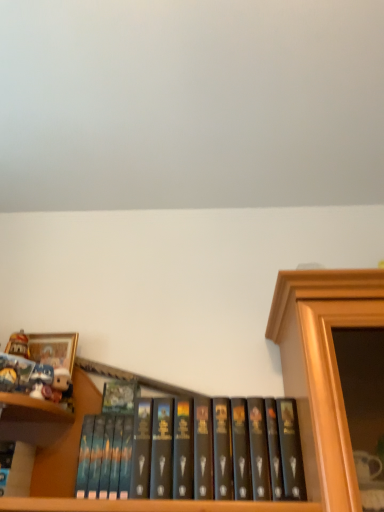
I want to click on gold-framed picture at upper left, so click(x=54, y=349).

Locate an element on the screen. black matte book at center, arranged as the 2th book when viewed from the left is located at coordinates coord(194,451).

Which object is wider, black matte book at center, which ranks as the first book in right-to-left order, or matte white plush toy at upper left?

black matte book at center, which ranks as the first book in right-to-left order.

In the image, is black matte book at center, which ranks as the first book in right-to-left order, positioned in front of or behind matte white plush toy at upper left?

In the image, black matte book at center, which ranks as the first book in right-to-left order, appears in front of matte white plush toy at upper left.

Can you confirm if black matte book at center, which ranks as the first book in right-to-left order, is bigger than matte white plush toy at upper left?

Yes.

In the scene shown: Is gold-framed picture at upper left inside black matte book at center, which ranks as the first book in right-to-left order?

No, black matte book at center, which ranks as the first book in right-to-left order, does not contain gold-framed picture at upper left.

I want to click on picture frame on the left of black matte book at center, which is the 2th book from top to bottom, so click(x=54, y=349).

Consider the image. Can you tell me how much black matte book at center, which is the 2th book from top to bottom, and gold-framed picture at upper left differ in facing direction?

The facing directions of black matte book at center, which is the 2th book from top to bottom, and gold-framed picture at upper left are 0.632 degrees apart.

Can you confirm if black matte book at center, which is the 2th book from top to bottom, is bigger than gold-framed picture at upper left?

Indeed, black matte book at center, which is the 2th book from top to bottom, has a larger size compared to gold-framed picture at upper left.

Is point (32, 351) less distant than point (8, 355)?

No, (32, 351) is behind (8, 355).

Who is taller, gold-framed picture at upper left or hardcover book at left, marked as the 1th book in a top-to-bottom arrangement?

gold-framed picture at upper left is taller.

Is hardcover book at left, marked as the 1th book in a top-to-bottom arrangement, at the back of gold-framed picture at upper left?

That's not correct — gold-framed picture at upper left is not looking away from hardcover book at left, marked as the 1th book in a top-to-bottom arrangement.

From the picture: From a real-world perspective, is gold-framed picture at upper left physically below hardcover book at left, marked as the 1th book in a top-to-bottom arrangement?

No, from a real-world perspective, gold-framed picture at upper left is not below hardcover book at left, marked as the 1th book in a top-to-bottom arrangement.

From a real-world perspective, is black matte book at center, which is the 2th book from top to bottom, physically below hardcover book at left, which is counted as the second book, starting from the right?

Yes, from a real-world perspective, black matte book at center, which is the 2th book from top to bottom, is under hardcover book at left, which is counted as the second book, starting from the right.

From the image's perspective, is black matte book at center, which is the 2th book from top to bottom, under hardcover book at left, which is counted as the second book, starting from the right?

Indeed, from the image's perspective, black matte book at center, which is the 2th book from top to bottom, is shown beneath hardcover book at left, which is counted as the second book, starting from the right.

Is black matte book at center, the 1th book from the bottom, with hardcover book at left, marked as the 1th book in a top-to-bottom arrangement?

They are not placed beside each other.

Does point (281, 487) lie in front of point (25, 364)?

That is True.

Could you tell me if hardcover book at left, placed as the 2th book when sorted from bottom to top, is facing matte white plush toy at upper left?

No, hardcover book at left, placed as the 2th book when sorted from bottom to top, is not aimed at matte white plush toy at upper left.

Is hardcover book at left, marked as the 1th book in a top-to-bottom arrangement, directly adjacent to matte white plush toy at upper left?

Yes, hardcover book at left, marked as the 1th book in a top-to-bottom arrangement, is next to matte white plush toy at upper left.

Is the position of hardcover book at left, placed as the 2th book when sorted from bottom to top, less distant than that of matte white plush toy at upper left?

Yes, it is in front of matte white plush toy at upper left.

The width and height of the screenshot is (384, 512). In order to click on toy on the right of hardcover book at left, which is counted as the second book, starting from the right in this screenshot , I will do `click(42, 382)`.

Between hardcover book at left, which is counted as the second book, starting from the right, and gold-framed picture at upper left, which one has less height?

With less height is hardcover book at left, which is counted as the second book, starting from the right.

From a real-world perspective, is hardcover book at left, which is counted as the second book, starting from the right, physically located above or below gold-framed picture at upper left?

hardcover book at left, which is counted as the second book, starting from the right, is below gold-framed picture at upper left.

Does hardcover book at left, placed as the 1th book when sorted from left to right, have a smaller size compared to gold-framed picture at upper left?

Indeed, hardcover book at left, placed as the 1th book when sorted from left to right, has a smaller size compared to gold-framed picture at upper left.

Where is `picture frame located above the hardcover book at left, placed as the 1th book when sorted from left to right (from a real-world perspective)`? picture frame located above the hardcover book at left, placed as the 1th book when sorted from left to right (from a real-world perspective) is located at coordinates (54, 349).

From a real-world perspective, is matte white plush toy at upper left physically located above or below hardcover book at left, placed as the 2th book when sorted from bottom to top?

Clearly, from a real-world perspective, matte white plush toy at upper left is below hardcover book at left, placed as the 2th book when sorted from bottom to top.

Relative to hardcover book at left, placed as the 2th book when sorted from bottom to top, is matte white plush toy at upper left in front or behind?

Visually, matte white plush toy at upper left is located behind hardcover book at left, placed as the 2th book when sorted from bottom to top.

From the image's perspective, relative to hardcover book at left, which is counted as the second book, starting from the right, is matte white plush toy at upper left above or below?

Based on their image positions, matte white plush toy at upper left is located beneath hardcover book at left, which is counted as the second book, starting from the right.

Identify the location of toy lying above the black matte book at center, arranged as the 2th book when viewed from the left (from the image's perspective). (42, 382).

The image size is (384, 512). Identify the location of the 2nd book in front when counting from the gold-framed picture at upper left. (194, 451).

Consider the image. Estimate the real-world distances between objects in this image. Which object is closer to matte white plush toy at upper left, gold-framed picture at upper left or black matte book at center, which is the 2th book from top to bottom?

gold-framed picture at upper left.

When comparing their distances from gold-framed picture at upper left, does black matte book at center, the 1th book from the bottom, or hardcover book at left, marked as the 1th book in a top-to-bottom arrangement, seem closer?

hardcover book at left, marked as the 1th book in a top-to-bottom arrangement, is positioned closer to the anchor gold-framed picture at upper left.

When comparing their distances from black matte book at center, arranged as the 2th book when viewed from the left, does matte white plush toy at upper left or hardcover book at left, placed as the 1th book when sorted from left to right, seem closer?

matte white plush toy at upper left.

Estimate the real-world distances between objects in this image. Which object is closer to black matte book at center, the 1th book from the bottom, hardcover book at left, placed as the 1th book when sorted from left to right, or gold-framed picture at upper left?

Based on the image, hardcover book at left, placed as the 1th book when sorted from left to right, appears to be nearer to black matte book at center, the 1th book from the bottom.

Looking at the image, which one is located further to hardcover book at left, placed as the 1th book when sorted from left to right, gold-framed picture at upper left or black matte book at center, the 1th book from the bottom?

The object further to hardcover book at left, placed as the 1th book when sorted from left to right, is black matte book at center, the 1th book from the bottom.

Looking at the image, which one is located closer to matte white plush toy at upper left, black matte book at center, the 1th book from the bottom, or gold-framed picture at upper left?

gold-framed picture at upper left is closer to matte white plush toy at upper left.

Looking at this image, considering their positions, is black matte book at center, arranged as the 2th book when viewed from the left, positioned further to hardcover book at left, placed as the 2th book when sorted from bottom to top, than matte white plush toy at upper left?

black matte book at center, arranged as the 2th book when viewed from the left, is positioned further to the anchor hardcover book at left, placed as the 2th book when sorted from bottom to top.

Estimate the real-world distances between objects in this image. Which object is closer to gold-framed picture at upper left, hardcover book at left, placed as the 1th book when sorted from left to right, or matte white plush toy at upper left?

matte white plush toy at upper left is positioned closer to the anchor gold-framed picture at upper left.

You are a GUI agent. You are given a task and a screenshot of the screen. Output one action in this format:
    pyautogui.click(x=<x>, y=<y>)
    Task: Click on the toy between gold-framed picture at upper left and black matte book at center, which is the 2th book from top to bottom, in the horizontal direction
    The width and height of the screenshot is (384, 512).
    Given the screenshot: What is the action you would take?
    pyautogui.click(x=42, y=382)

The image size is (384, 512). What are the coordinates of `picture frame between hardcover book at left, placed as the 2th book when sorted from bottom to top, and black matte book at center, arranged as the 2th book when viewed from the left, in the horizontal direction` in the screenshot? It's located at (54, 349).

You are a GUI agent. You are given a task and a screenshot of the screen. Output one action in this format:
    pyautogui.click(x=<x>, y=<y>)
    Task: Click on the toy situated between hardcover book at left, which is counted as the second book, starting from the right, and black matte book at center, which ranks as the first book in right-to-left order, from left to right
    Image resolution: width=384 pixels, height=512 pixels.
    Given the screenshot: What is the action you would take?
    pyautogui.click(x=42, y=382)

At what (x,y) coordinates should I click in order to perform the action: click on toy between hardcover book at left, marked as the 1th book in a top-to-bottom arrangement, and gold-framed picture at upper left in the front-back direction. Please return your answer as a coordinate pair (x, y). The width and height of the screenshot is (384, 512). Looking at the image, I should click on (42, 382).